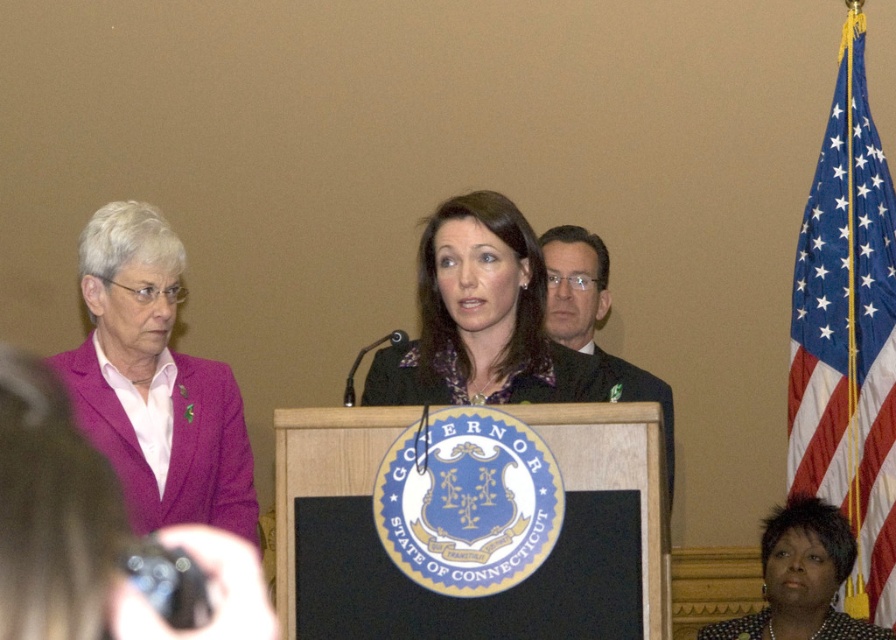
Who is higher up, pink fabric jacket at left or dark suit at center?

dark suit at center

Does pink fabric jacket at left appear on the left side of dark suit at center?

Correct, you'll find pink fabric jacket at left to the left of dark suit at center.

You are a GUI agent. You are given a task and a screenshot of the screen. Output one action in this format:
    pyautogui.click(x=<x>, y=<y>)
    Task: Click on the pink fabric jacket at left
    Image resolution: width=896 pixels, height=640 pixels.
    Given the screenshot: What is the action you would take?
    pyautogui.click(x=154, y=381)

Who is lower down, matte black jacket at center or dark suit at center?

dark suit at center

Can you confirm if matte black jacket at center is smaller than dark suit at center?

Indeed, matte black jacket at center has a smaller size compared to dark suit at center.

You are a GUI agent. You are given a task and a screenshot of the screen. Output one action in this format:
    pyautogui.click(x=<x>, y=<y>)
    Task: Click on the matte black jacket at center
    Image resolution: width=896 pixels, height=640 pixels.
    Given the screenshot: What is the action you would take?
    pyautogui.click(x=480, y=317)

Is point (851, 304) farther from viewer compared to point (448, 307)?

Yes, point (851, 304) is behind point (448, 307).

In the scene shown: Between blue fabric flag at right and matte black jacket at center, which one is positioned higher?

blue fabric flag at right

Is point (799, 276) behind point (429, 275)?

Yes, it is behind point (429, 275).

The height and width of the screenshot is (640, 896). I want to click on blue fabric flag at right, so click(849, 336).